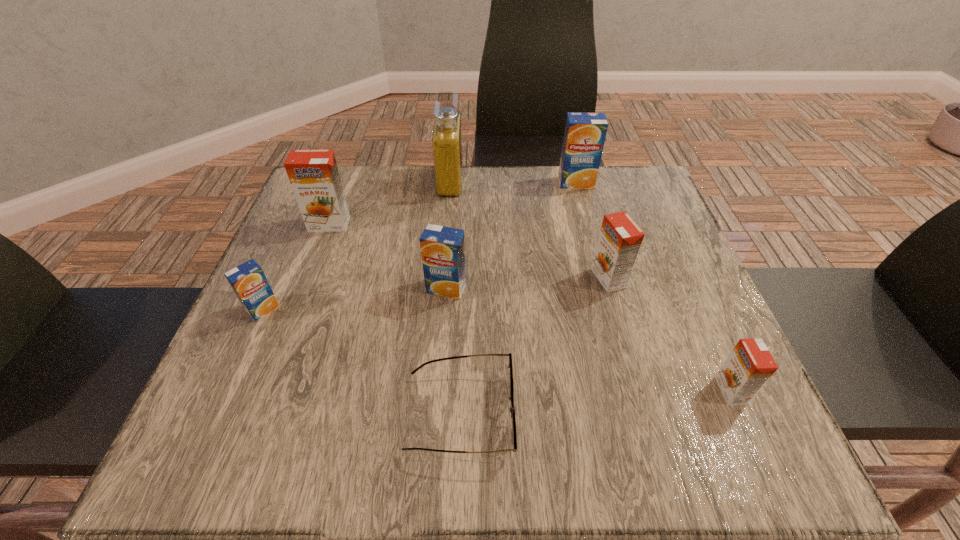
You are a GUI agent. You are given a task and a screenshot of the screen. Output one action in this format:
    pyautogui.click(x=<x>, y=<y>)
    Task: Click on the nearest orange juice
    
    Given the screenshot: What is the action you would take?
    pyautogui.click(x=750, y=365)

Find the location of a particular element. the rightmost orange juice is located at coordinates (750, 365).

Where is `spectacles`? This screenshot has height=540, width=960. spectacles is located at coordinates (512, 409).

Where is `free spot located 0.370m on the front-facing side of the tallest object`? free spot located 0.370m on the front-facing side of the tallest object is located at coordinates (603, 181).

Identify the location of vacant space located 0.110m on the front of the biggest blue orange_juice. The height and width of the screenshot is (540, 960). point(585,215).

Locate an element on the screen. vacant space situated on the right of the fifth nearest orange juice is located at coordinates (518, 224).

Where is `free space located 0.140m on the back of the second smallest orange orange juice`? The width and height of the screenshot is (960, 540). free space located 0.140m on the back of the second smallest orange orange juice is located at coordinates (593, 223).

Identify the location of free spot located on the left of the second blue orange_juice from left to right. (269, 288).

In order to click on free space located on the back of the smallest blue orange_juice in this screenshot , I will do (276, 280).

This screenshot has height=540, width=960. Find the location of `free space located 0.390m on the left of the rightmost object`. free space located 0.390m on the left of the rightmost object is located at coordinates (487, 390).